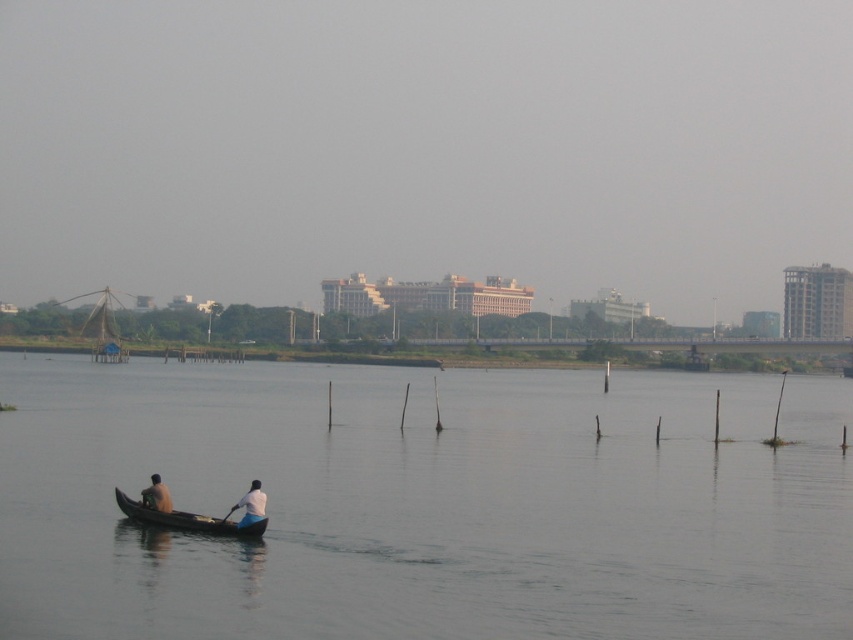
You are standing at the point with coordinates point (251, 509) and want to reach the point with coordinates point (572, 397). Which direction should you move in to get closer to your destination?

You should move backward because point (572, 397) is behind point (251, 509).

You are standing on the riverside and see the white fabric shirt at lower center and the white plastic paddle at lower center in the boat. Which object is closer to you?

The white fabric shirt at lower center is closer to you because it is in front of the white plastic paddle at lower center.

You are standing on the riverside and want to walk towards both the point at coordinates point (256, 484) and point (222, 518). Which point will you reach first?

You will reach point (256, 484) first because it is closer to you than point (222, 518).